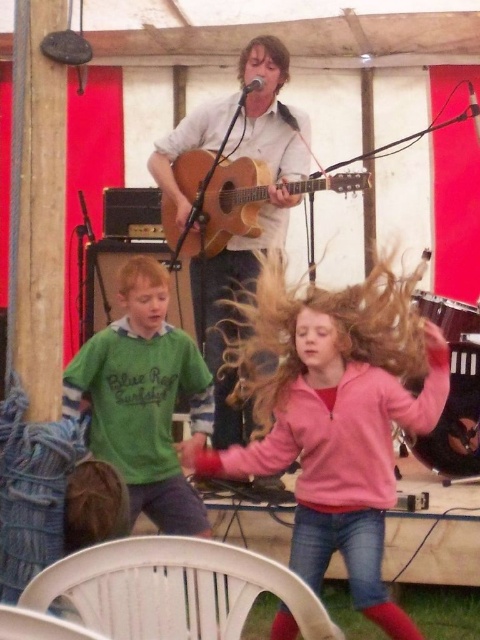
You are a photographer at the event and want to capture a clear shot of the wooden acoustic guitar at center without any obstruction. Is the pink fleece jacket at center blocking the view of the guitar?

The pink fleece jacket at center is positioned under the wooden acoustic guitar at center, so it is blocking the view of the guitar from the front. To capture a clear shot, you would need to adjust your angle or position to avoid the jacket.

You are at the festival and want to find the pink fleece jacket at center. According to the spatial coordinates provided, where should you look relative to the musician?

The pink fleece jacket at center is located at point 0.652 on the x axis and 0.702 on the y axis relative to the musician.

You are a photographer at the event and want to take a photo of the green matte shirt at left and the wooden acoustic guitar at center. Which object is positioned lower in the image?

The green matte shirt at left is located below the wooden acoustic guitar at center, so the green matte shirt at left is positioned lower in the image.